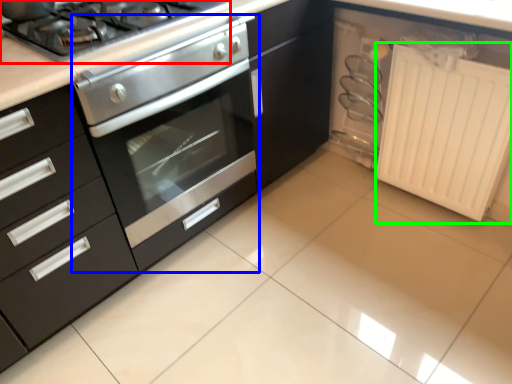
Question: Based on their relative distances, which object is farther from gas stove (highlighted by a red box)? Choose from oven (highlighted by a blue box) and radiator (highlighted by a green box).

Choices:
 (A) oven
 (B) radiator

Answer: (B)